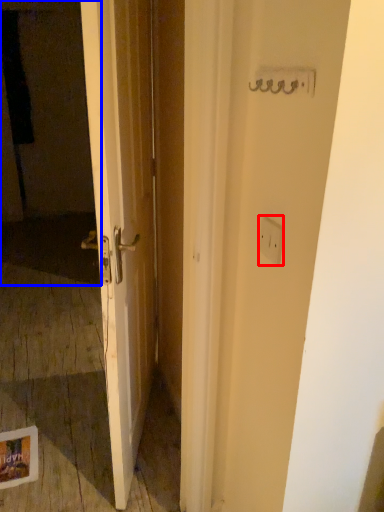
Question: Which object appears closest to the camera in this image, electric outlet (highlighted by a red box) or screen door (highlighted by a blue box)?

Choices:
 (A) electric outlet
 (B) screen door

Answer: (A)